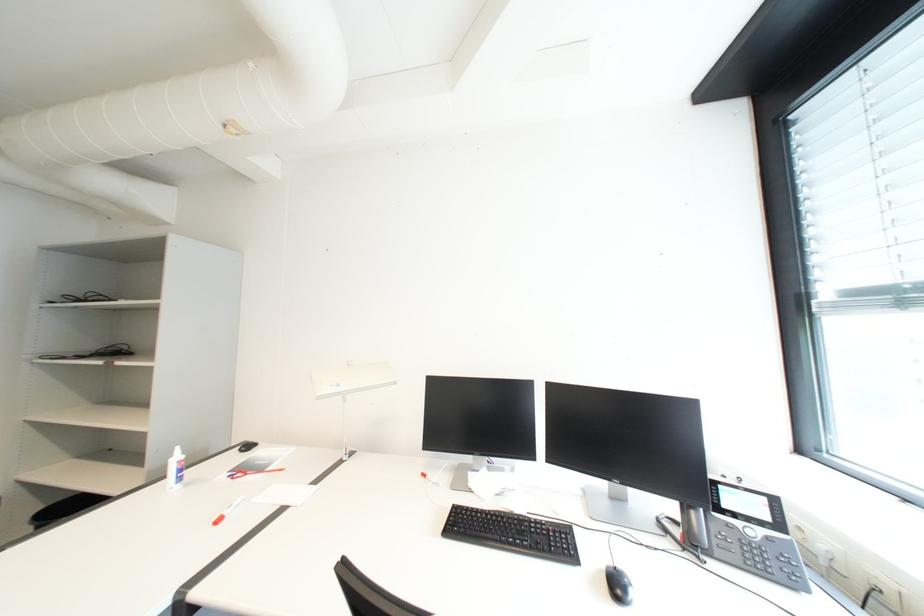
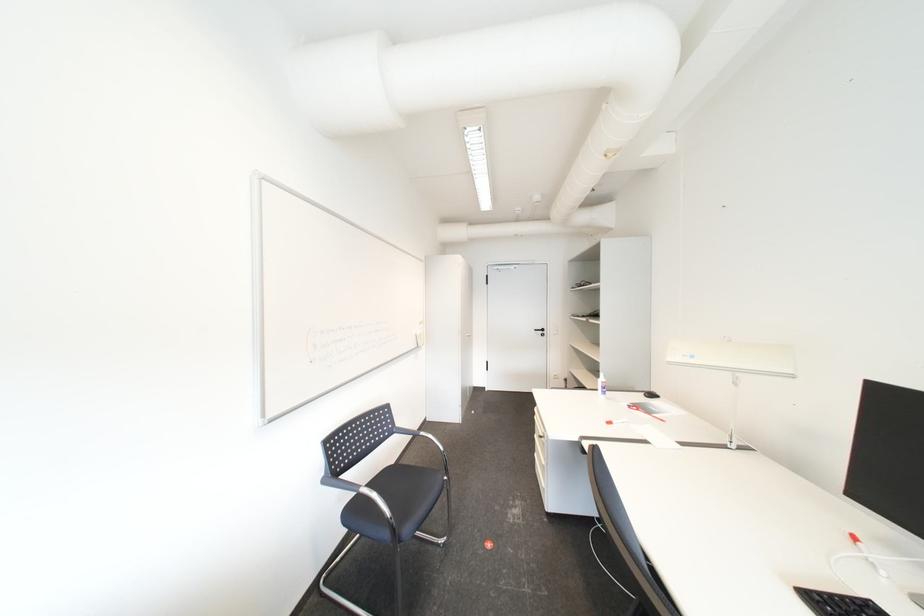
Question: The camera is either moving clockwise (left) or counter-clockwise (right) around the object. The first image is from the beginning of the video and the second image is from the end. Is the camera moving left or right when shooting the video?

Choices:
 (A) Left
 (B) Right

Answer: (B)